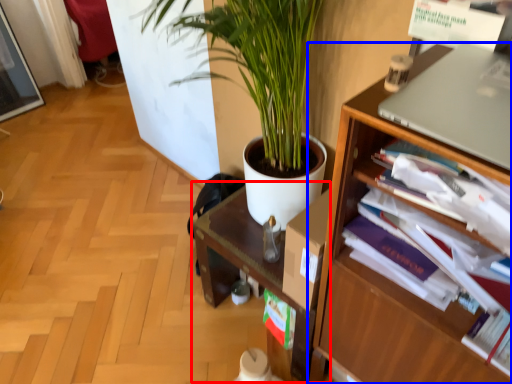
Question: Which object is further to the camera taking this photo, computer desk (highlighted by a red box) or shelf (highlighted by a blue box)?

Choices:
 (A) computer desk
 (B) shelf

Answer: (A)